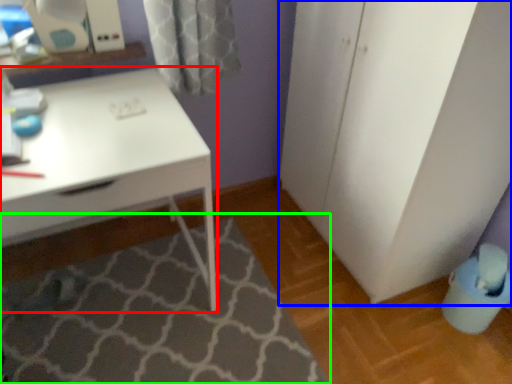
Question: Which is nearer to the desk (highlighted by a red box)? file cabinet (highlighted by a blue box) or bath mat (highlighted by a green box).

Choices:
 (A) file cabinet
 (B) bath mat

Answer: (B)